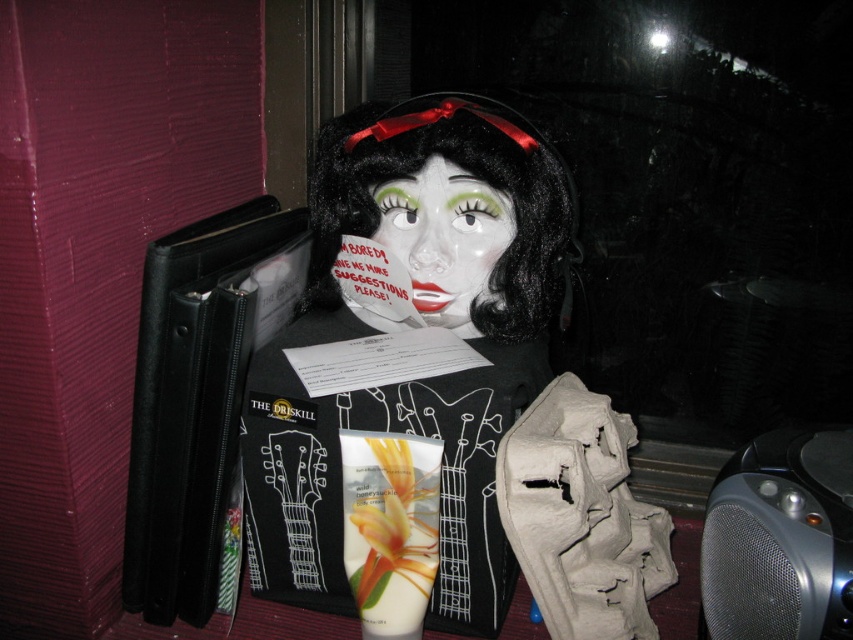
Does black velvet wig at center have a lesser height compared to porcelain face at center?

In fact, black velvet wig at center may be taller than porcelain face at center.

Does point (316, 284) lie behind point (492, 250)?

That is True.

From the picture: Who is more forward, (310, 291) or (428, 262)?

Positioned in front is point (428, 262).

The height and width of the screenshot is (640, 853). Identify the location of black velvet wig at center. (471, 177).

Between matte black doll at center and porcelain face at center, which one is positioned higher?

porcelain face at center is above.

Between point (610, 538) and point (405, 246), which one is positioned behind?

Positioned behind is point (405, 246).

Which is behind, point (252, 524) or point (485, 289)?

Positioned behind is point (252, 524).

Locate an element on the screen. The image size is (853, 640). matte black doll at center is located at coordinates (444, 390).

From the picture: Does matte black doll at center appear on the right side of black velvet wig at center?

In fact, matte black doll at center is to the left of black velvet wig at center.

Locate an element on the screen. matte black doll at center is located at coordinates (444, 390).